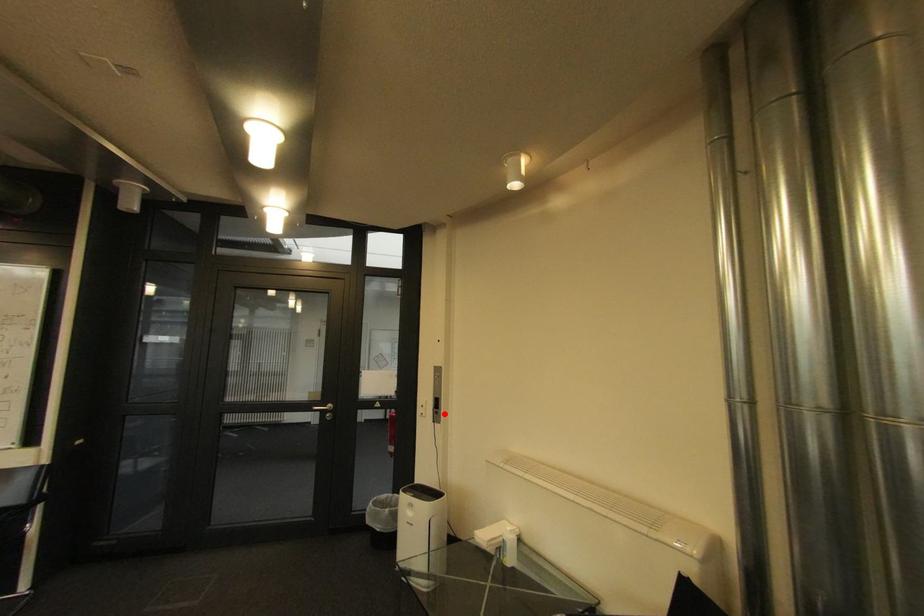
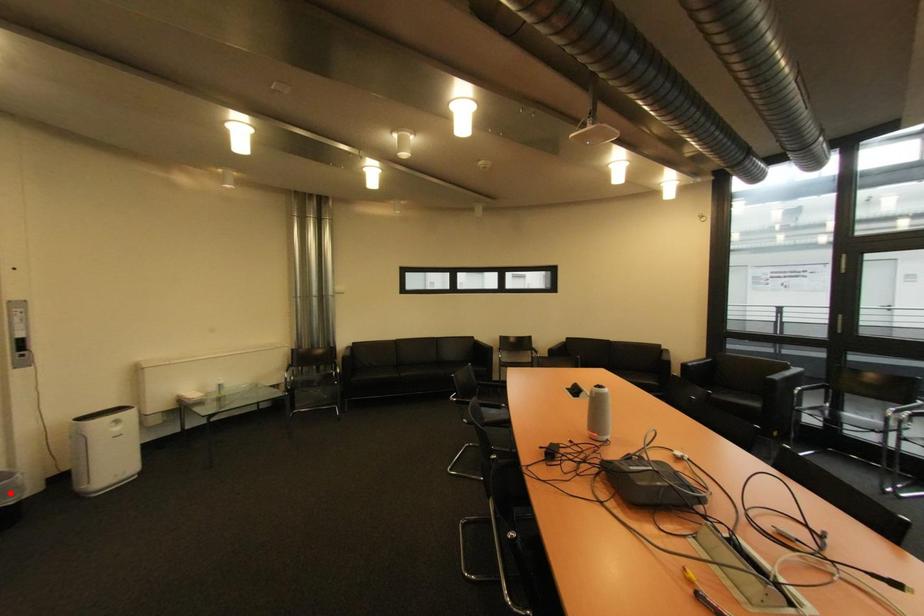
I am providing you with two images of the same scene from different viewpoints. A red point is marked on the first image and another point is marked on the second image. Are the points marked in image1 and image2 representing the same 3D position?

No